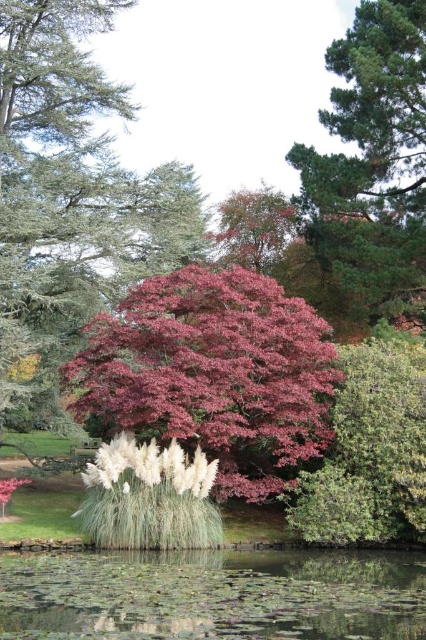
Question: Can you confirm if green textured bush at center is smaller than pink matte maple at center?

Choices:
 (A) yes
 (B) no

Answer: (A)

Question: Which of the following is the farthest from the observer?

Choices:
 (A) (317, 566)
 (B) (265, 269)
 (C) (97, 221)

Answer: (B)

Question: Can you confirm if green textured bush at center is thinner than pink matte maple at center?

Choices:
 (A) yes
 (B) no

Answer: (A)

Question: Does pink glossy tree at center appear on the right side of purple glossy maple at center?

Choices:
 (A) yes
 (B) no

Answer: (B)

Question: Based on their relative distances, which object is nearer to the smooth green pine tree at upper right?

Choices:
 (A) purple glossy maple at center
 (B) transparent glass water at lower center
 (C) pink matte maple at center
 (D) pink glossy tree at center

Answer: (D)

Question: Which of the following is the closest to the observer?

Choices:
 (A) (394, 417)
 (B) (137, 106)

Answer: (A)